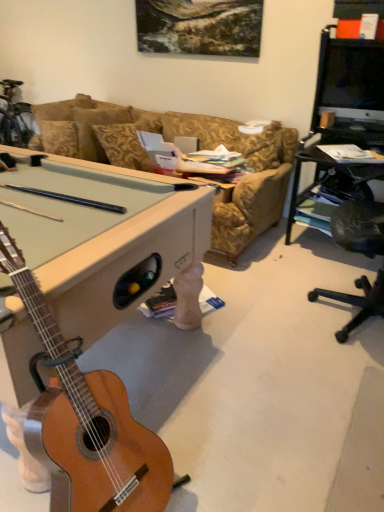
Identify the location of free space to the back side of natural wood guitar at lower left. This screenshot has height=512, width=384. (176, 411).